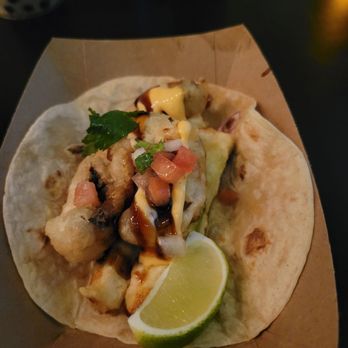
Locate an element on the screen. This screenshot has height=348, width=348. paper box is located at coordinates (189, 69).